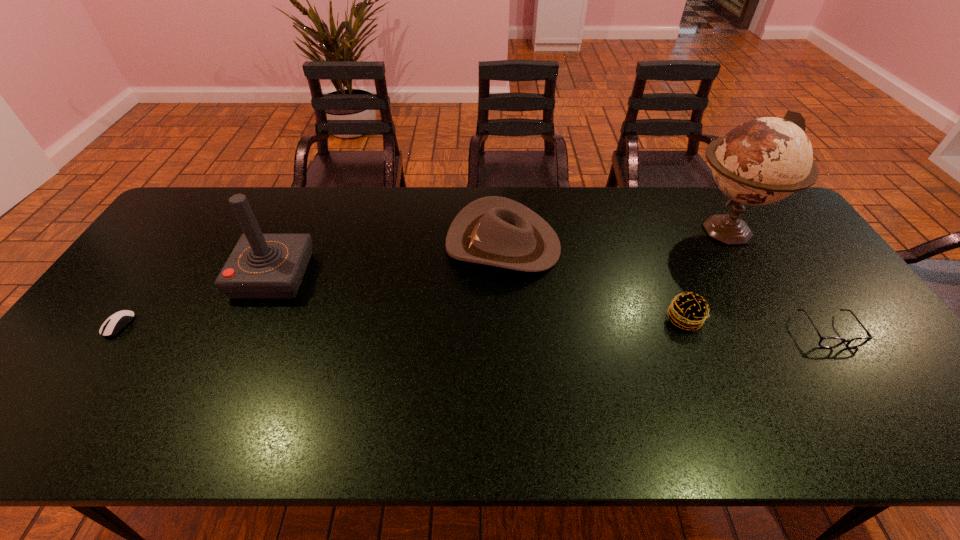
The image size is (960, 540). I want to click on vacant space that is in between the cowboy hat and the globe, so click(x=614, y=237).

Find the location of a particular element. The width and height of the screenshot is (960, 540). vacant point located between the third object from right to left and the fourth object from right to left is located at coordinates (594, 282).

This screenshot has height=540, width=960. Identify the location of free space between the joystick and the third shortest object. (479, 297).

This screenshot has height=540, width=960. What are the coordinates of `vacant point located between the spectacles and the fifth shortest object` in the screenshot? It's located at (550, 303).

Locate an element on the screen. The image size is (960, 540). vacant space that's between the shortest object and the fifth tallest object is located at coordinates (473, 328).

Where is `vacant space in between the third shortest object and the cowboy hat`? This screenshot has height=540, width=960. vacant space in between the third shortest object and the cowboy hat is located at coordinates (594, 282).

Find the location of a particular element. empty space between the second shortest object and the shortest object is located at coordinates (473, 328).

Identify the location of free space between the joystick and the leftmost object. (196, 300).

This screenshot has width=960, height=540. Identify the location of unoccupied position between the fifth tallest object and the fourth object from right to left. (665, 288).

Where is `free spot between the globe and the fifth tallest object`? The image size is (960, 540). free spot between the globe and the fifth tallest object is located at coordinates (777, 280).